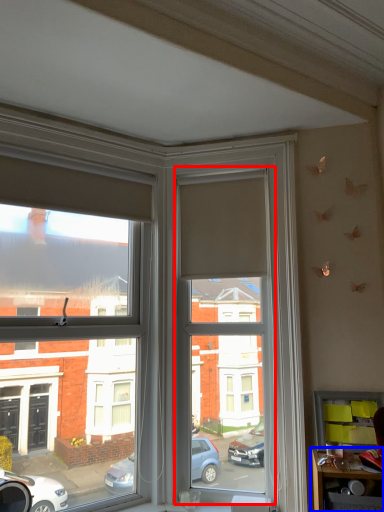
Question: Which point is further to the camera, window screen (highlighted by a red box) or table (highlighted by a blue box)?

Choices:
 (A) window screen
 (B) table

Answer: (A)